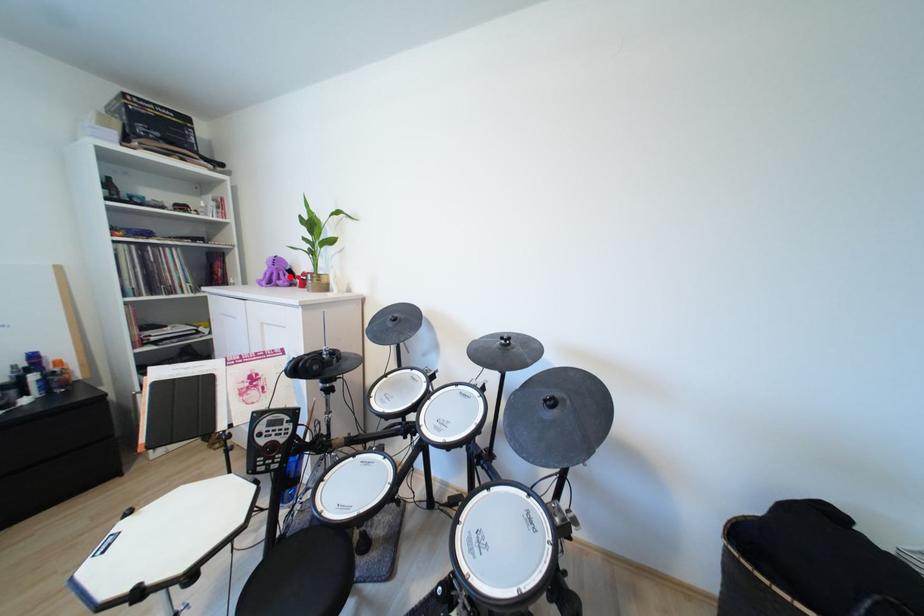
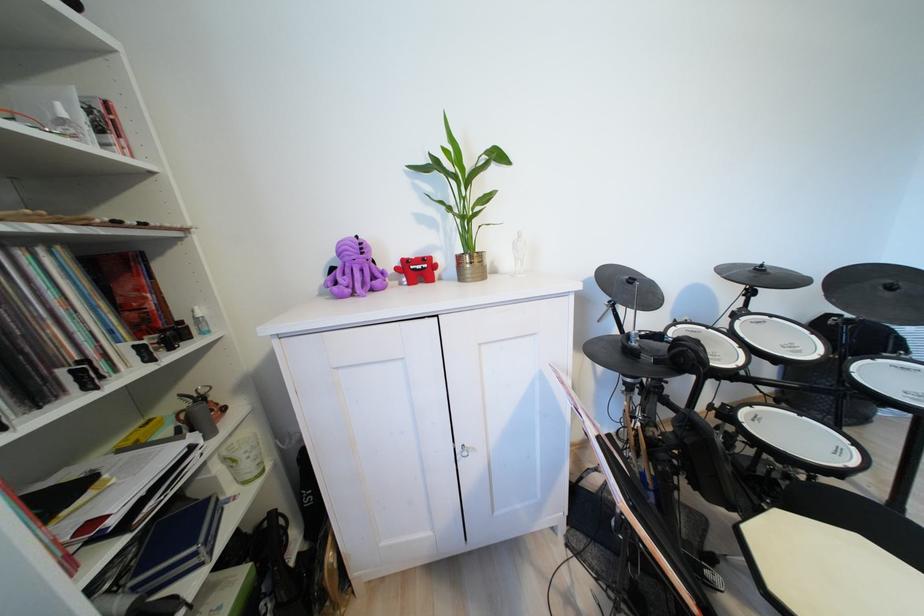
Locate, in the second image, the point that corresponds to the highlighted location in the first image.

(360, 274)